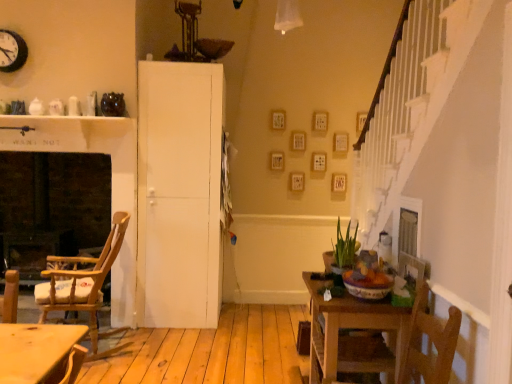
Question: Should I look upward or downward to see white matte door at center?

Choices:
 (A) up
 (B) down

Answer: (B)

Question: Does green matte plant at center have a greater width compared to black metal clock at upper left?

Choices:
 (A) no
 (B) yes

Answer: (B)

Question: Is green matte plant at center smaller than black metal clock at upper left?

Choices:
 (A) no
 (B) yes

Answer: (A)

Question: Does green matte plant at center have a greater height compared to black metal clock at upper left?

Choices:
 (A) yes
 (B) no

Answer: (A)

Question: From a real-world perspective, is green matte plant at center physically below black metal clock at upper left?

Choices:
 (A) yes
 (B) no

Answer: (A)

Question: Considering the relative sizes of green matte plant at center and black metal clock at upper left in the image provided, is green matte plant at center thinner than black metal clock at upper left?

Choices:
 (A) no
 (B) yes

Answer: (A)

Question: Does green matte plant at center lie in front of black metal clock at upper left?

Choices:
 (A) yes
 (B) no

Answer: (A)

Question: Does white matte door at center have a greater height compared to black metal clock at upper left?

Choices:
 (A) yes
 (B) no

Answer: (A)

Question: Is white matte door at center bigger than black metal clock at upper left?

Choices:
 (A) yes
 (B) no

Answer: (A)

Question: Is white matte door at center next to black metal clock at upper left and touching it?

Choices:
 (A) no
 (B) yes

Answer: (A)

Question: Could black metal clock at upper left be considered to be inside white matte door at center?

Choices:
 (A) yes
 (B) no

Answer: (B)

Question: From a real-world perspective, is white matte door at center physically below black metal clock at upper left?

Choices:
 (A) yes
 (B) no

Answer: (A)

Question: Is white matte door at center further to camera compared to black metal clock at upper left?

Choices:
 (A) yes
 (B) no

Answer: (A)

Question: Is white matte door at center not within brick fireplace at left?

Choices:
 (A) no
 (B) yes

Answer: (B)